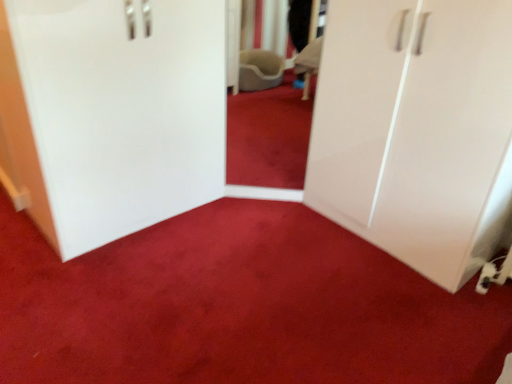
Question: Are matte white wardrobe at center and white glossy cupboard at right located far from each other?

Choices:
 (A) no
 (B) yes

Answer: (A)

Question: Does matte white wardrobe at center turn towards white glossy cupboard at right?

Choices:
 (A) no
 (B) yes

Answer: (A)

Question: Is matte white wardrobe at center bigger than white glossy cupboard at right?

Choices:
 (A) yes
 (B) no

Answer: (B)

Question: From the image's perspective, would you say matte white wardrobe at center is shown under white glossy cupboard at right?

Choices:
 (A) yes
 (B) no

Answer: (A)

Question: From a real-world perspective, is matte white wardrobe at center located beneath white glossy cupboard at right?

Choices:
 (A) no
 (B) yes

Answer: (B)

Question: Does matte white wardrobe at center have a smaller size compared to white glossy cupboard at right?

Choices:
 (A) yes
 (B) no

Answer: (A)

Question: From a real-world perspective, is white glossy cupboard at right located higher than white glossy cabinet at left?

Choices:
 (A) no
 (B) yes

Answer: (B)

Question: Are white glossy cupboard at right and white glossy cabinet at left located far from each other?

Choices:
 (A) yes
 (B) no

Answer: (A)

Question: Is white glossy cupboard at right looking in the opposite direction of white glossy cabinet at left?

Choices:
 (A) yes
 (B) no

Answer: (B)

Question: From the image's perspective, is white glossy cupboard at right above white glossy cabinet at left?

Choices:
 (A) no
 (B) yes

Answer: (A)

Question: From a real-world perspective, does white glossy cupboard at right sit lower than white glossy cabinet at left?

Choices:
 (A) no
 (B) yes

Answer: (A)

Question: Does white glossy cupboard at right turn towards white glossy cabinet at left?

Choices:
 (A) yes
 (B) no

Answer: (B)

Question: Is white glossy cabinet at left at the right side of white glossy cupboard at right?

Choices:
 (A) yes
 (B) no

Answer: (B)